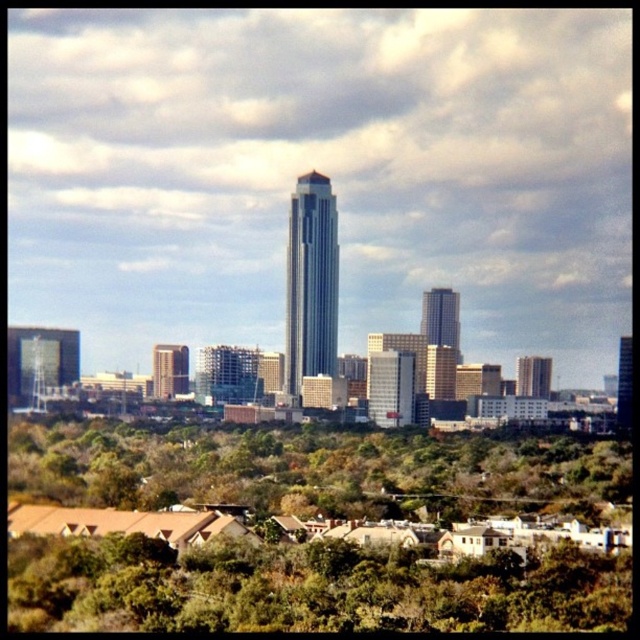
Question: Which object is the farthest from the matte glass skyscraper at center?

Choices:
 (A) green leafy trees at lower center
 (B) silver glass skyscraper at center

Answer: (B)

Question: Can you confirm if sleek glass skyscraper at center is bigger than matte gray building at right?

Choices:
 (A) yes
 (B) no

Answer: (A)

Question: Which of the following is the farthest from the observer?

Choices:
 (A) (368, 515)
 (B) (516, 381)

Answer: (B)

Question: Can you confirm if white glass building at center is bigger than sleek glass skyscraper at center?

Choices:
 (A) no
 (B) yes

Answer: (B)

Question: Estimate the real-world distances between objects in this image. Which object is closer to the silver glass skyscraper at center?

Choices:
 (A) green leafy tree at lower center
 (B) green leafy trees at lower center
 (C) white glass building at center

Answer: (C)

Question: Does green leafy trees at lower center appear on the left side of matte gray building at right?

Choices:
 (A) yes
 (B) no

Answer: (A)